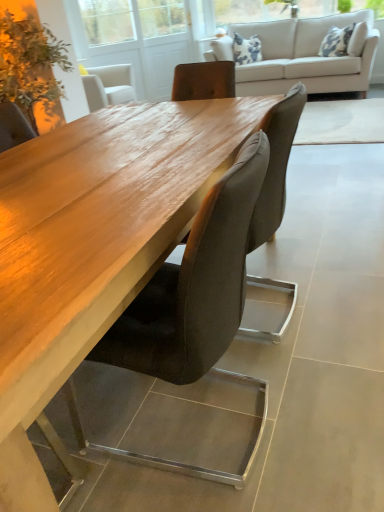
Question: From a real-world perspective, is green leafy plant at upper left positioned over suede-like brown chair at center, arranged as the second chair when viewed from the front, based on gravity?

Choices:
 (A) no
 (B) yes

Answer: (B)

Question: Is green leafy plant at upper left at the left side of suede-like brown chair at center, arranged as the second chair when viewed from the front?

Choices:
 (A) yes
 (B) no

Answer: (A)

Question: Is green leafy plant at upper left beside suede-like brown chair at center, marked as the first chair in a back-to-front arrangement?

Choices:
 (A) yes
 (B) no

Answer: (B)

Question: Is green leafy plant at upper left looking in the opposite direction of suede-like brown chair at center, arranged as the second chair when viewed from the front?

Choices:
 (A) no
 (B) yes

Answer: (A)

Question: Is suede-like brown chair at center, marked as the first chair in a back-to-front arrangement, inside green leafy plant at upper left?

Choices:
 (A) no
 (B) yes

Answer: (A)

Question: Visually, is transparent glass screen door at upper center positioned to the left or to the right of green leafy plant at upper left?

Choices:
 (A) right
 (B) left

Answer: (A)

Question: In terms of size, does transparent glass screen door at upper center appear bigger or smaller than green leafy plant at upper left?

Choices:
 (A) small
 (B) big

Answer: (A)

Question: Considering the positions of transparent glass screen door at upper center and green leafy plant at upper left in the image, is transparent glass screen door at upper center wider or thinner than green leafy plant at upper left?

Choices:
 (A) wide
 (B) thin

Answer: (B)

Question: Is point (145, 4) positioned closer to the camera than point (28, 89)?

Choices:
 (A) farther
 (B) closer

Answer: (A)

Question: In the image, is suede-like brown chair at center, marked as the first chair in a back-to-front arrangement, positioned in front of or behind transparent glass screen door at upper center?

Choices:
 (A) behind
 (B) front

Answer: (B)

Question: Considering the positions of suede-like brown chair at center, marked as the first chair in a back-to-front arrangement, and transparent glass screen door at upper center in the image, is suede-like brown chair at center, marked as the first chair in a back-to-front arrangement, taller or shorter than transparent glass screen door at upper center?

Choices:
 (A) short
 (B) tall

Answer: (A)

Question: In terms of width, does suede-like brown chair at center, arranged as the second chair when viewed from the front, look wider or thinner when compared to transparent glass screen door at upper center?

Choices:
 (A) thin
 (B) wide

Answer: (B)

Question: Considering the positions of suede-like brown chair at center, arranged as the second chair when viewed from the front, and transparent glass screen door at upper center in the image, is suede-like brown chair at center, arranged as the second chair when viewed from the front, bigger or smaller than transparent glass screen door at upper center?

Choices:
 (A) big
 (B) small

Answer: (B)

Question: Considering the positions of beige fabric couch at upper center and transparent glass screen door at upper center in the image, is beige fabric couch at upper center bigger or smaller than transparent glass screen door at upper center?

Choices:
 (A) small
 (B) big

Answer: (B)

Question: Is beige fabric couch at upper center wider or thinner than transparent glass screen door at upper center?

Choices:
 (A) thin
 (B) wide

Answer: (B)